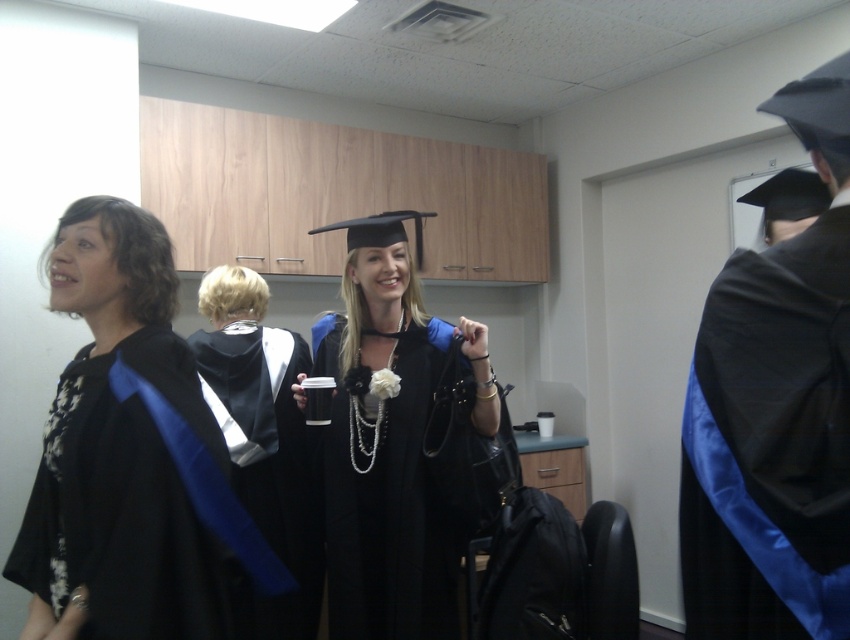
Looking at the scene of graduates in the preparation room, you notice two gowns. Which one is positioned more to the left side between the black satin gown at left and the satin black gown at center?

The black satin gown at left is positioned more to the left side compared to the satin black gown at center.

Based on the photo, you are a photographer in the room and want to capture a photo of both the matte black graduation gown at center and the satin black gown at center. Which gown should you focus on first to ensure it appears larger in the photo?

The matte black graduation gown at center is much taller than the satin black gown at center, so you should focus on the matte black graduation gown at center first to ensure it appears larger in the photo.